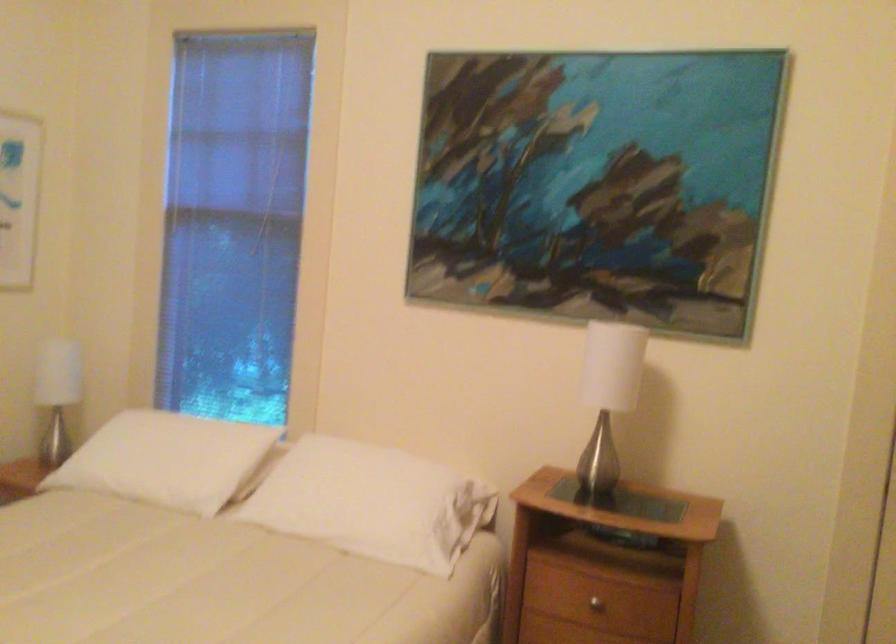
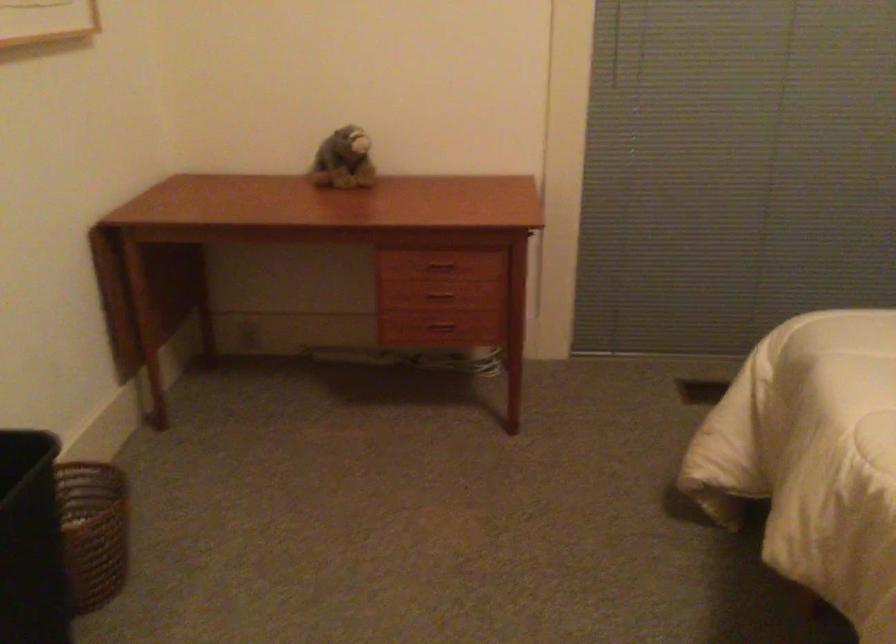
The images are taken continuously from a first-person perspective. In which direction is your viewpoint rotating?

The rotation direction of the camera is left-down.